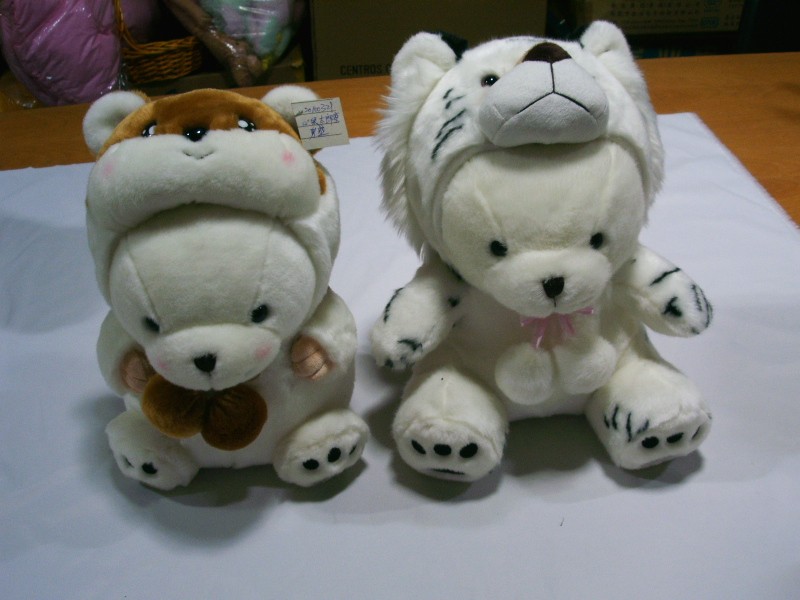
The width and height of the screenshot is (800, 600). I want to click on wood table, so click(x=769, y=111).